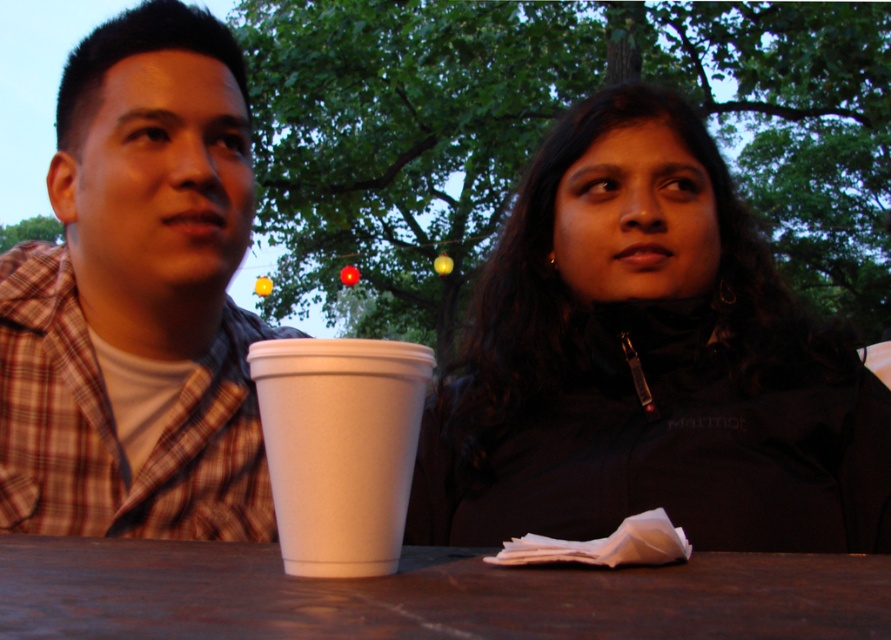
Based on the photo, can you confirm if brown wooden table at center is positioned to the left of white styrofoam cup at center?

In fact, brown wooden table at center is to the right of white styrofoam cup at center.

Describe the element at coordinates (424, 595) in the screenshot. I see `brown wooden table at center` at that location.

Between point (722, 612) and point (354, 508), which one is positioned in front?

Point (722, 612) is more forward.

The height and width of the screenshot is (640, 891). What are the coordinates of `brown wooden table at center` in the screenshot? It's located at (424, 595).

In the scene shown: Can you confirm if black matte jacket at center is thinner than plaid shirt at left?

Incorrect, black matte jacket at center's width is not less than plaid shirt at left's.

Who is more distant from viewer, (769, 406) or (172, 131)?

Point (769, 406)

Is point (726, 211) closer to viewer compared to point (238, 248)?

No, it is not.

This screenshot has height=640, width=891. What are the coordinates of `black matte jacket at center` in the screenshot? It's located at (648, 368).

Does plaid shirt at left have a greater width compared to brown wooden table at center?

In fact, plaid shirt at left might be narrower than brown wooden table at center.

Who is more forward, [21,461] or [394,586]?

Point [394,586]

Does point (0, 477) come farther from viewer compared to point (407, 602)?

Yes, it is.

I want to click on plaid shirt at left, so click(x=137, y=294).